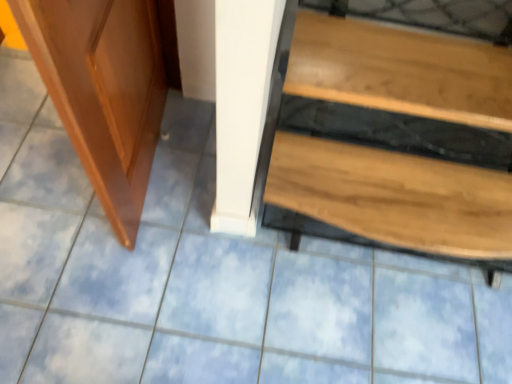
Measure the distance between wooden table at lower right and camera.

1.16 meters.

What do you see at coordinates (395, 197) in the screenshot? I see `wooden table at lower right` at bounding box center [395, 197].

You are a GUI agent. You are given a task and a screenshot of the screen. Output one action in this format:
    pyautogui.click(x=<x>, y=<y>)
    Task: Click on the wooden table at lower right
    This screenshot has width=512, height=384.
    Given the screenshot: What is the action you would take?
    pyautogui.click(x=395, y=197)

The image size is (512, 384). What do you see at coordinates (103, 91) in the screenshot? I see `shiny brown wood screen door at left` at bounding box center [103, 91].

The height and width of the screenshot is (384, 512). In order to click on shiny brown wood screen door at left in this screenshot , I will do `click(103, 91)`.

At what (x,y) coordinates should I click in order to perform the action: click on wooden table at lower right. Please return your answer as a coordinate pair (x, y). The height and width of the screenshot is (384, 512). Looking at the image, I should click on (395, 197).

Is wooden table at lower right to the left of shiny brown wood screen door at left from the viewer's perspective?

In fact, wooden table at lower right is to the right of shiny brown wood screen door at left.

Is wooden table at lower right closer to the viewer compared to shiny brown wood screen door at left?

No.

Does point (408, 32) appear closer or farther from the camera than point (159, 30)?

Point (408, 32) appears to be closer to the viewer than point (159, 30).

From the image's perspective, is wooden table at lower right under shiny brown wood screen door at left?

Indeed, from the image's perspective, wooden table at lower right is shown beneath shiny brown wood screen door at left.

From a real-world perspective, who is located higher, wooden table at lower right or shiny brown wood screen door at left?

In real-world perspective, shiny brown wood screen door at left is above.

Which object is thinner, wooden table at lower right or shiny brown wood screen door at left?

shiny brown wood screen door at left is thinner.

Who is shorter, wooden table at lower right or shiny brown wood screen door at left?

wooden table at lower right is shorter.

Is wooden table at lower right bigger or smaller than shiny brown wood screen door at left?

Considering their sizes, wooden table at lower right takes up more space than shiny brown wood screen door at left.

Is shiny brown wood screen door at left completely or partially inside wooden table at lower right?

No, shiny brown wood screen door at left is not surrounded by wooden table at lower right.

Can you see wooden table at lower right touching shiny brown wood screen door at left?

They are not placed beside each other.

Looking at this image, is shiny brown wood screen door at left at the back of wooden table at lower right?

No, wooden table at lower right is not facing away from shiny brown wood screen door at left.

How different are the orientations of wooden table at lower right and shiny brown wood screen door at left in degrees?

The angular difference between wooden table at lower right and shiny brown wood screen door at left is 86 degrees.

Measure the distance from wooden table at lower right to shiny brown wood screen door at left.

The distance of wooden table at lower right from shiny brown wood screen door at left is 24.87 inches.

The image size is (512, 384). Identify the location of furniture directly beneath the shiny brown wood screen door at left (from a real-world perspective). (395, 197).

Considering the relative positions of shiny brown wood screen door at left and wooden table at lower right in the image provided, is shiny brown wood screen door at left to the left of wooden table at lower right from the viewer's perspective?

Yes, shiny brown wood screen door at left is to the left of wooden table at lower right.

Is shiny brown wood screen door at left closer to the viewer compared to wooden table at lower right?

That is True.

Does point (82, 33) come behind point (482, 252)?

No, it is not.

From the image's perspective, which object appears higher, shiny brown wood screen door at left or wooden table at lower right?

shiny brown wood screen door at left, from the image's perspective.

From a real-world perspective, is shiny brown wood screen door at left located higher than wooden table at lower right?

Yes, from a real-world perspective, shiny brown wood screen door at left is on top of wooden table at lower right.

Can you confirm if shiny brown wood screen door at left is wider than wooden table at lower right?

Incorrect, the width of shiny brown wood screen door at left does not surpass that of wooden table at lower right.

Can you confirm if shiny brown wood screen door at left is taller than wooden table at lower right?

Yes.

Does shiny brown wood screen door at left have a larger size compared to wooden table at lower right?

No.

Is wooden table at lower right located within shiny brown wood screen door at left?

No, wooden table at lower right is not a part of shiny brown wood screen door at left.

Is shiny brown wood screen door at left next to wooden table at lower right?

No.

Is shiny brown wood screen door at left aimed at wooden table at lower right?

No.

What are the coordinates of `furniture lying on the right of shiny brown wood screen door at left` in the screenshot? It's located at (395, 197).

Locate an element on the screen. Image resolution: width=512 pixels, height=384 pixels. furniture on the right side of shiny brown wood screen door at left is located at coordinates (395, 197).

You are a GUI agent. You are given a task and a screenshot of the screen. Output one action in this format:
    pyautogui.click(x=<x>, y=<y>)
    Task: Click on the furniture below the shiny brown wood screen door at left (from the image's perspective)
    
    Given the screenshot: What is the action you would take?
    pyautogui.click(x=395, y=197)